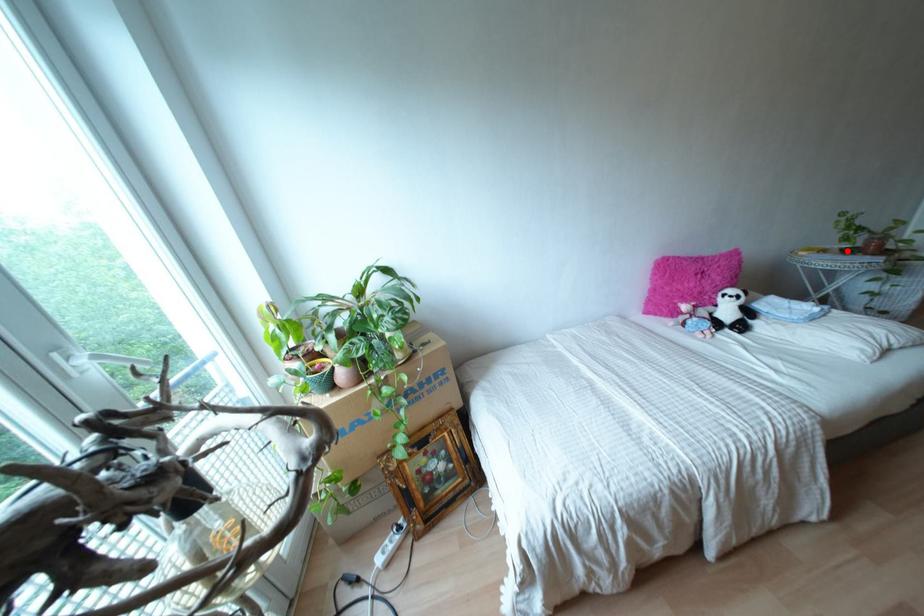
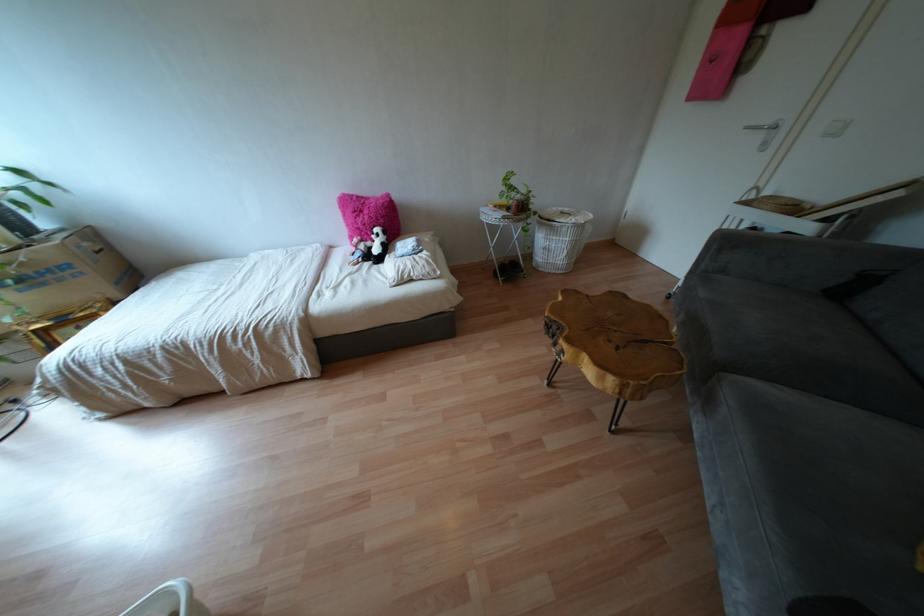
Where in the second image is the point corresponding to the highlighted location from the first image?

(506, 208)